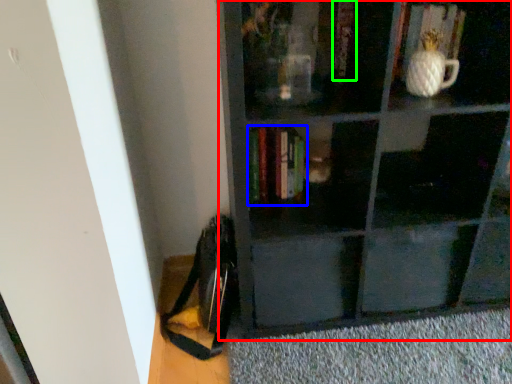
Question: Which object is the farthest from shelf (highlighted by a red box)? Choose among these: book (highlighted by a blue box) or book (highlighted by a green box).

Choices:
 (A) book
 (B) book

Answer: (B)